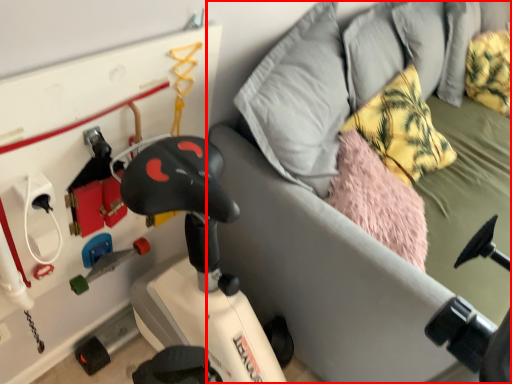
Question: Where is furniture (annotated by the red box) located in relation to pillow in the image?

Choices:
 (A) right
 (B) left

Answer: (A)